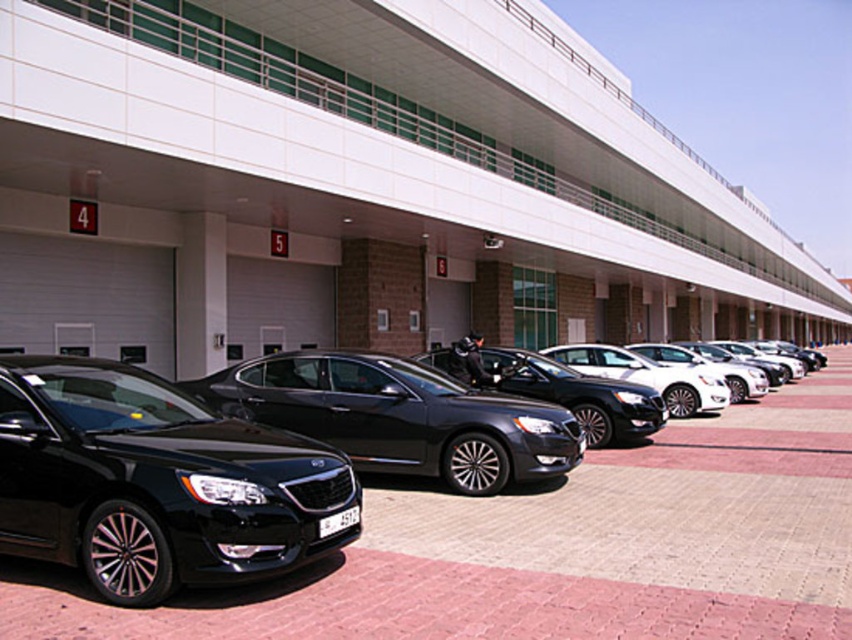
You are a delivery person standing at the camera position. You need to place a package on the shiny black sedan at center. Can you reach the sedan without moving the car?

The shiny black sedan at center and camera are 4.74 meters apart from each other. Since the distance is more than an average person can reach, you cannot place the package without moving the car.

You are standing at the entrance of the building and want to park your car in the parking bay closest to the point marked at coordinates (157, 483). Which garage door number should you aim for?

The black metallic sedan at center is located at point (157, 483), so you should aim for the garage door number corresponding to the parking bay where the black metallic sedan at center is parked.

You are standing at the point marked by coordinates point (579,396). Looking around, you see a sleek black sedan at center. What object is located at your current position?

The sleek black sedan at center is located at the point marked by coordinates point (579,396).